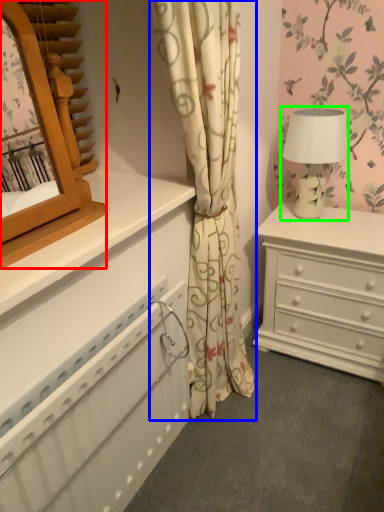
Question: Which is farther away from mirror (highlighted by a red box)? curtain (highlighted by a blue box) or table lamp (highlighted by a green box)?

Choices:
 (A) curtain
 (B) table lamp

Answer: (B)